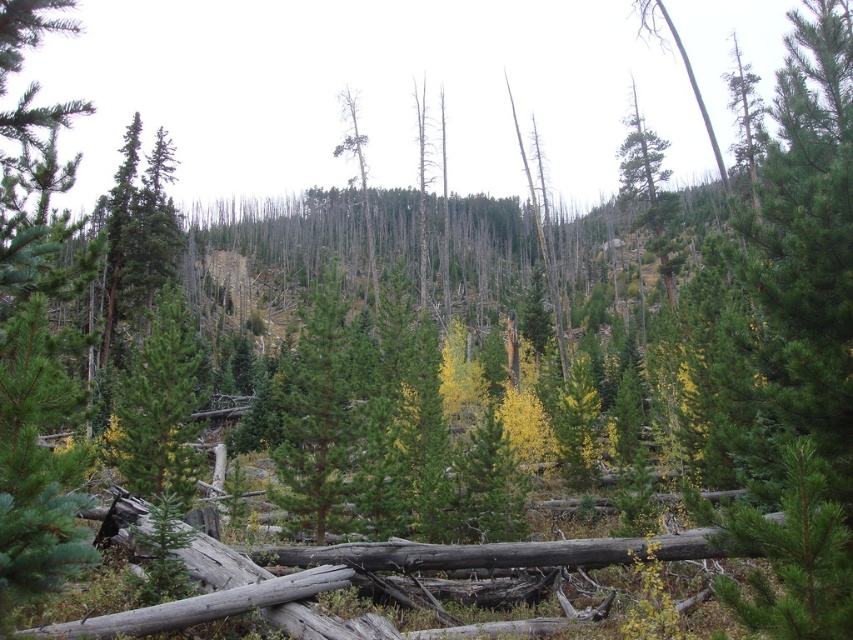
At what (x,y) coordinates should I click in order to perform the action: click on green matte tree at center. Please return your answer as a coordinate pair (x, y). This screenshot has height=640, width=853. Looking at the image, I should click on click(x=315, y=416).

Where is `green matte tree at center`? This screenshot has width=853, height=640. green matte tree at center is located at coordinates (315, 416).

Which of these two, green matte tree at upper right or dead wood at center, stands shorter?

green matte tree at upper right is shorter.

What do you see at coordinates (645, 172) in the screenshot? I see `green matte tree at upper right` at bounding box center [645, 172].

The height and width of the screenshot is (640, 853). I want to click on green matte tree at upper right, so click(x=645, y=172).

Is the position of green matte tree at center less distant than that of green matte tree at upper right?

Yes.

Between green matte tree at center and green matte tree at upper right, which one has more height?

green matte tree at upper right

Between point (311, 496) and point (654, 218), which one is positioned in front?

Point (311, 496)

Identify the location of green matte tree at center. (315, 416).